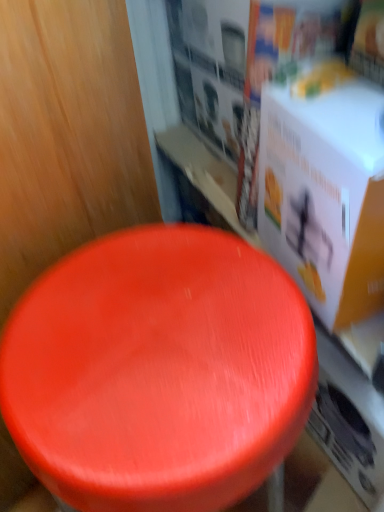
Measure the distance between white cardboard box at upper right and camera.

white cardboard box at upper right and camera are 12.14 inches apart from each other.

You are a GUI agent. You are given a task and a screenshot of the screen. Output one action in this format:
    pyautogui.click(x=<x>, y=<y>)
    Task: Click on the white cardboard box at upper right
    Image resolution: width=384 pixels, height=512 pixels.
    Given the screenshot: What is the action you would take?
    pyautogui.click(x=326, y=193)

Describe the element at coordinates (326, 193) in the screenshot. I see `white cardboard box at upper right` at that location.

This screenshot has width=384, height=512. What do you see at coordinates (158, 371) in the screenshot? I see `shiny red stool at center` at bounding box center [158, 371].

At what (x,y) coordinates should I click in order to perform the action: click on shiny red stool at center. Please return your answer as a coordinate pair (x, y). Looking at the image, I should click on (158, 371).

Based on the photo, what is the approximate width of shiny red stool at center?

shiny red stool at center is 14.90 inches in width.

Locate an element on the screen. This screenshot has width=384, height=512. white cardboard box at upper right is located at coordinates (326, 193).

Which is more to the left, white cardboard box at upper right or shiny red stool at center?

Positioned to the left is shiny red stool at center.

Is the position of white cardboard box at upper right less distant than that of shiny red stool at center?

That is False.

Considering the points (362, 89) and (225, 295), which point is behind, point (362, 89) or point (225, 295)?

The point (225, 295) is behind.

From the image's perspective, does white cardboard box at upper right appear higher than shiny red stool at center?

Indeed, from the image's perspective, white cardboard box at upper right is shown above shiny red stool at center.

From a real-world perspective, which object stands above the other?

From a 3D spatial view, white cardboard box at upper right is above.

Between white cardboard box at upper right and shiny red stool at center, which one has smaller width?

white cardboard box at upper right.

Considering the relative sizes of white cardboard box at upper right and shiny red stool at center in the image provided, is white cardboard box at upper right taller than shiny red stool at center?

No, white cardboard box at upper right is not taller than shiny red stool at center.

Does white cardboard box at upper right have a smaller size compared to shiny red stool at center?

Correct, white cardboard box at upper right occupies less space than shiny red stool at center.

Is white cardboard box at upper right surrounding shiny red stool at center?

Definitely not — shiny red stool at center is not inside white cardboard box at upper right.

Are white cardboard box at upper right and shiny red stool at center beside each other?

No, white cardboard box at upper right is not making contact with shiny red stool at center.

Could you tell me if white cardboard box at upper right is turned towards shiny red stool at center?

No, white cardboard box at upper right is not turned towards shiny red stool at center.

How many degrees apart are the facing directions of white cardboard box at upper right and shiny red stool at center?

28.2 degrees separate the facing orientations of white cardboard box at upper right and shiny red stool at center.

You are a GUI agent. You are given a task and a screenshot of the screen. Output one action in this format:
    pyautogui.click(x=<x>, y=<y>)
    Task: Click on the stool beneath the white cardboard box at upper right (from a real-world perspective)
    This screenshot has width=384, height=512.
    Given the screenshot: What is the action you would take?
    pyautogui.click(x=158, y=371)

In the scene shown: Considering the positions of objects shiny red stool at center and white cardboard box at upper right in the image provided, who is more to the right, shiny red stool at center or white cardboard box at upper right?

Positioned to the right is white cardboard box at upper right.

Considering the positions of objects shiny red stool at center and white cardboard box at upper right in the image provided, who is behind, shiny red stool at center or white cardboard box at upper right?

white cardboard box at upper right is more distant.

Which is closer to the camera, (x=45, y=369) or (x=306, y=216)?

Point (x=45, y=369) is positioned closer to the camera compared to point (x=306, y=216).

From the image's perspective, is shiny red stool at center on white cardboard box at upper right?

Incorrect, from the image's perspective, shiny red stool at center is lower than white cardboard box at upper right.

From a real-world perspective, between shiny red stool at center and white cardboard box at upper right, who is vertically lower?

shiny red stool at center is physically lower.

Which object is wider, shiny red stool at center or white cardboard box at upper right?

shiny red stool at center.

Is shiny red stool at center taller or shorter than white cardboard box at upper right?

In the image, shiny red stool at center appears to be taller than white cardboard box at upper right.

Considering the sizes of objects shiny red stool at center and white cardboard box at upper right in the image provided, who is bigger, shiny red stool at center or white cardboard box at upper right?

shiny red stool at center is bigger.

Is shiny red stool at center surrounding white cardboard box at upper right?

No, white cardboard box at upper right is located outside of shiny red stool at center.

Would you consider shiny red stool at center to be distant from white cardboard box at upper right?

Actually, shiny red stool at center and white cardboard box at upper right are a little close together.

From the picture: Is shiny red stool at center turned away from white cardboard box at upper right?

No, shiny red stool at center's orientation is not away from white cardboard box at upper right.

Measure the distance between shiny red stool at center and white cardboard box at upper right.

shiny red stool at center is 6.11 inches from white cardboard box at upper right.

Locate an element on the screen. The width and height of the screenshot is (384, 512). stool in front of the white cardboard box at upper right is located at coordinates (158, 371).

Find the location of a particular element. This screenshot has width=384, height=512. stool on the left of white cardboard box at upper right is located at coordinates (158, 371).

This screenshot has height=512, width=384. There is a shiny red stool at center. Identify the location of box above it (from a real-world perspective). [326, 193].